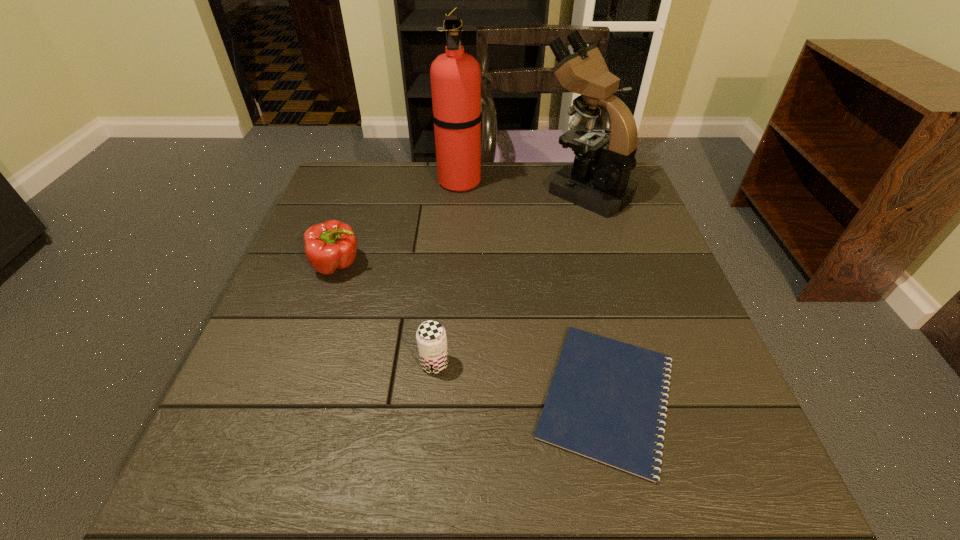
In order to click on free space that is in between the shortest object and the fourth tallest object in this screenshot , I will do `click(520, 380)`.

Where is `vacant space that's between the fourth shortest object and the leftmost object`? vacant space that's between the fourth shortest object and the leftmost object is located at coordinates (462, 228).

Image resolution: width=960 pixels, height=540 pixels. Identify the location of empty location between the fourth shortest object and the beer can. (510, 277).

I want to click on free spot between the fourth tallest object and the fire extinguisher, so click(x=447, y=272).

This screenshot has width=960, height=540. In order to click on free area in between the pepper and the fourth tallest object in this screenshot , I will do `click(386, 314)`.

Locate which object ranks in proximity to the notepad. Please provide its 2D coordinates. Your answer should be formatted as a tuple, i.e. [(x, y)], where the tuple contains the x and y coordinates of a point satisfying the conditions above.

[(431, 338)]

The height and width of the screenshot is (540, 960). I want to click on object that is the second nearest to the shortest object, so click(x=598, y=180).

Locate an element on the screen. This screenshot has width=960, height=540. free space that satisfies the following two spatial constraints: 1. at the nozzle of the microscope; 2. on the left side of the fire extinguisher is located at coordinates (459, 191).

This screenshot has width=960, height=540. What are the coordinates of `free space that satisfies the following two spatial constraints: 1. at the nozzle of the fourth shortest object; 2. on the right side of the fire extinguisher` in the screenshot? It's located at (459, 191).

Locate an element on the screen. The height and width of the screenshot is (540, 960). free space that satisfies the following two spatial constraints: 1. at the nozzle of the microscope; 2. on the right side of the fire extinguisher is located at coordinates (459, 191).